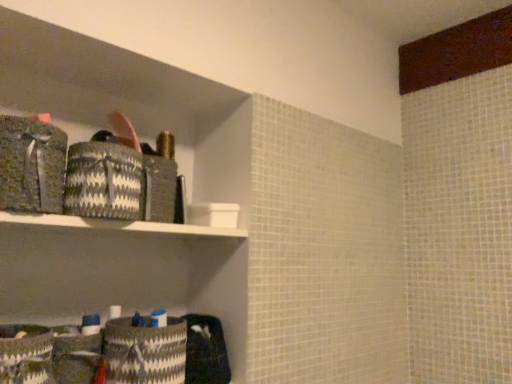
Locate an element on the screen. The width and height of the screenshot is (512, 384). free space above white and black woven basket at lower left, which appears as the 3th material when viewed from the top (from a real-world perspective) is located at coordinates (144, 319).